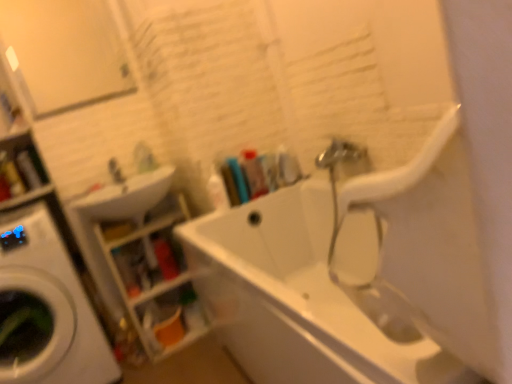
The height and width of the screenshot is (384, 512). Find the location of `free space in front of satin nickel faucet at upper left`. free space in front of satin nickel faucet at upper left is located at coordinates (111, 192).